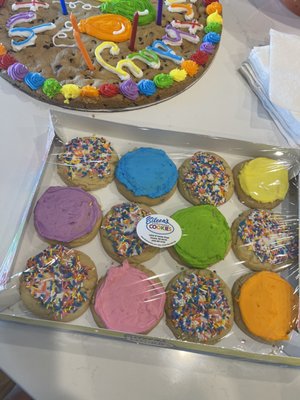
The height and width of the screenshot is (400, 300). Identify the location of candles on the cookie cake. pyautogui.click(x=158, y=11), pyautogui.click(x=133, y=33), pyautogui.click(x=78, y=41), pyautogui.click(x=72, y=20), pyautogui.click(x=64, y=5).